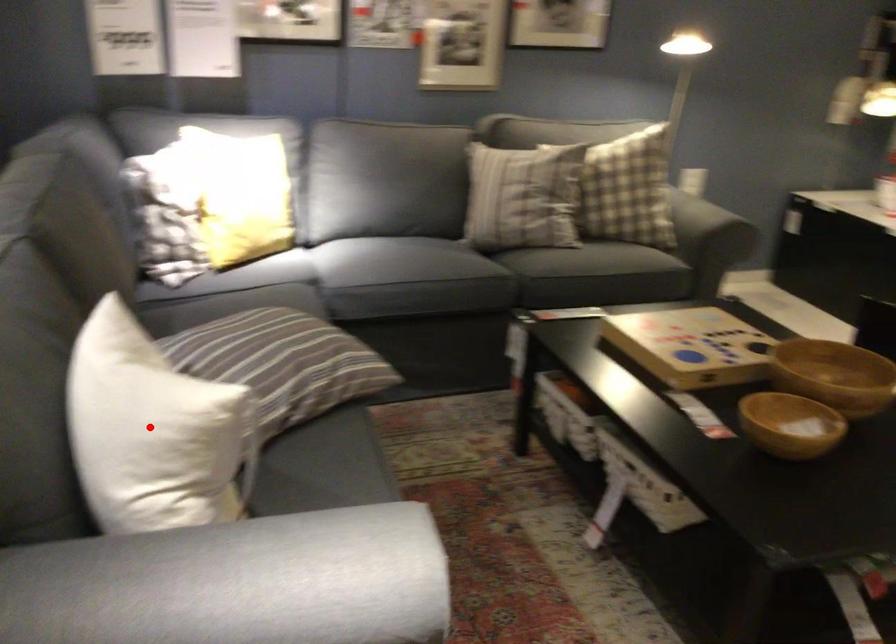
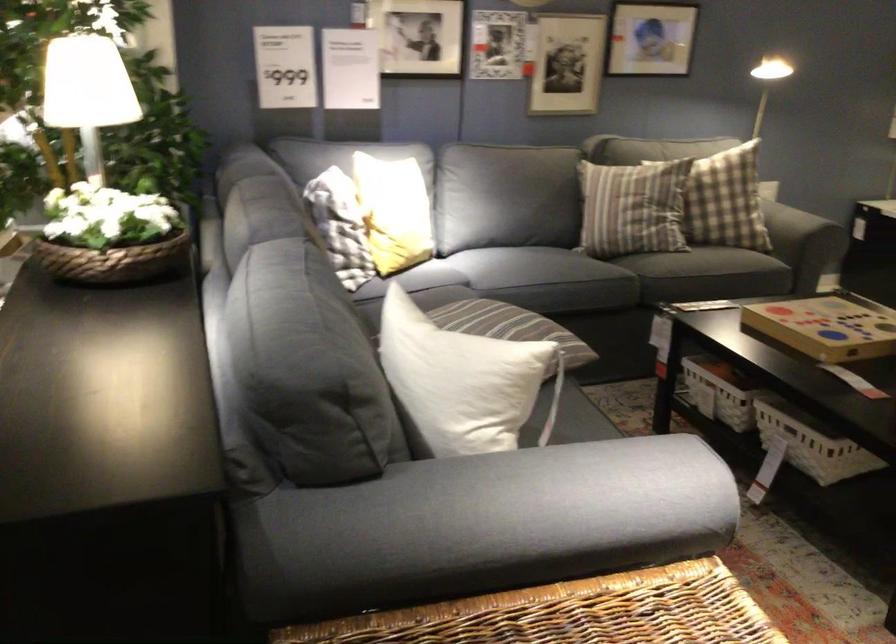
Where in the second image is the point corresponding to the highlighted location from the first image?

(462, 381)